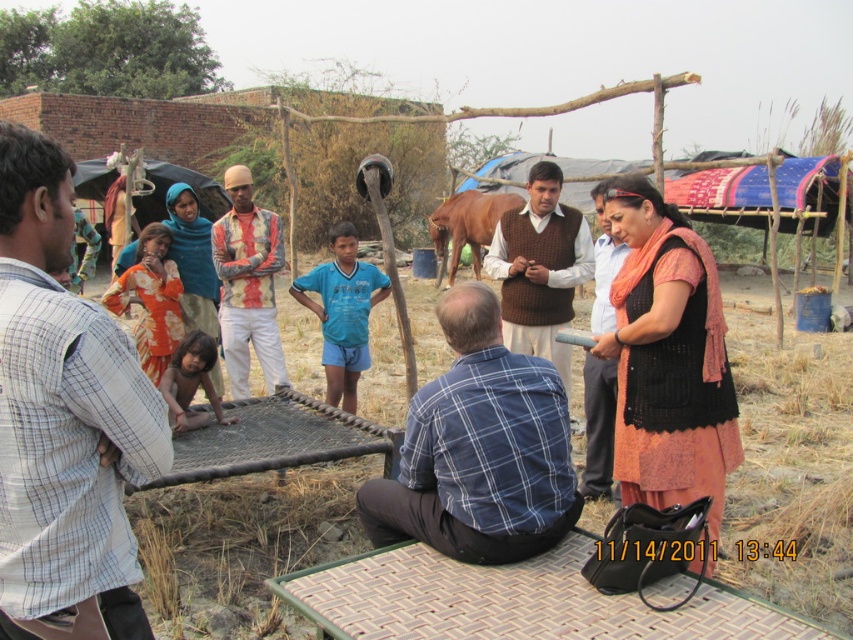
Question: Is brown knitted vest at center smaller than brown knitted sweater at center?

Choices:
 (A) yes
 (B) no

Answer: (A)

Question: Observing the image, what is the correct spatial positioning of white checkered shirt at left in reference to blue plaid shirt at center?

Choices:
 (A) below
 (B) above

Answer: (B)

Question: Which of the following is the closest to the observer?

Choices:
 (A) (257, 312)
 (B) (502, 202)

Answer: (A)

Question: Can you confirm if brown knitted vest at center is smaller than brown knitted sweater at center?

Choices:
 (A) no
 (B) yes

Answer: (B)

Question: Among these points, which one is farthest from the camera?

Choices:
 (A) tap(697, 333)
 (B) tap(590, 312)
 (C) tap(247, 176)

Answer: (B)

Question: Among these points, which one is nearest to the camera?

Choices:
 (A) (264, 228)
 (B) (604, 253)

Answer: (B)